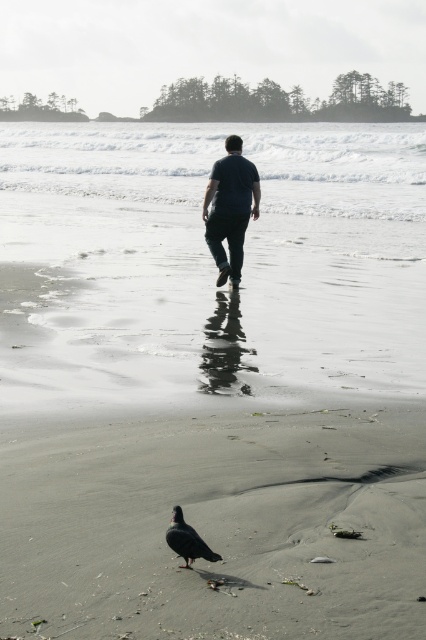
Is gray sand at center thinner than dark blue shirt at center?

Incorrect, gray sand at center's width is not less than dark blue shirt at center's.

The height and width of the screenshot is (640, 426). What do you see at coordinates (215, 525) in the screenshot?
I see `gray sand at center` at bounding box center [215, 525].

Where is `gray sand at center`? gray sand at center is located at coordinates (215, 525).

Find the location of a particular element. This screenshot has width=426, height=640. gray sand at center is located at coordinates (215, 525).

Who is more distant from viewer, (241, 145) or (198, 554)?

The point (241, 145) is behind.

Does dark blue shirt at center have a lesser width compared to black feathered pigeon at lower center?

No.

What are the coordinates of `dark blue shirt at center` in the screenshot? It's located at (230, 209).

Is gray sand at center below white smooth water at center?

Correct, gray sand at center is located below white smooth water at center.

Does gray sand at center have a lesser width compared to white smooth water at center?

Indeed, gray sand at center has a lesser width compared to white smooth water at center.

Between point (57, 532) and point (322, 196), which one is positioned behind?

The point (322, 196) is behind.

Identify the location of gray sand at center. (215, 525).